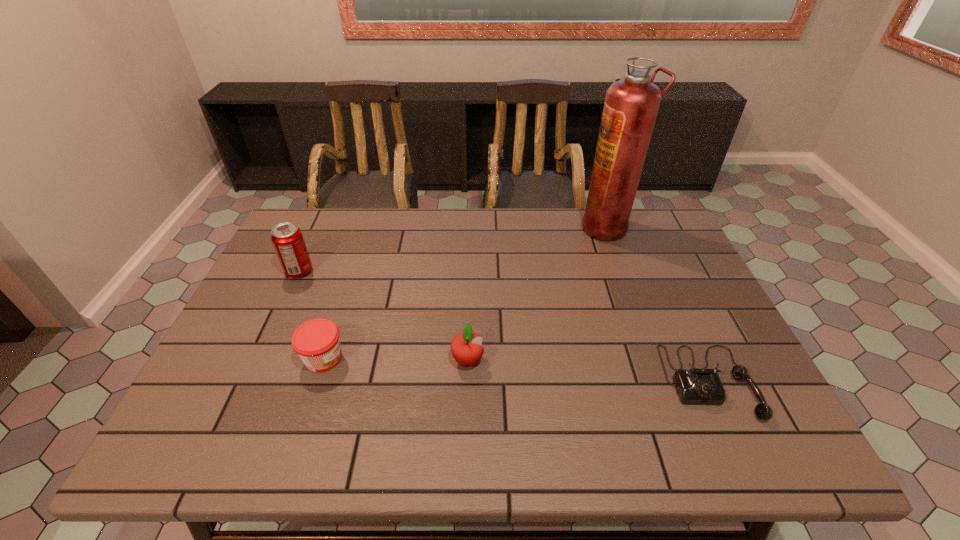
At what (x,y) coordinates should I click in order to perform the action: click on unoccupied area between the fourth object from right to left and the fire extinguisher. Please return your answer as a coordinate pair (x, y). The width and height of the screenshot is (960, 540). Looking at the image, I should click on (465, 293).

Where is `vacant region between the third object from left to right and the second farthest object`? This screenshot has height=540, width=960. vacant region between the third object from left to right and the second farthest object is located at coordinates (383, 316).

You are a GUI agent. You are given a task and a screenshot of the screen. Output one action in this format:
    pyautogui.click(x=<x>, y=<y>)
    Task: Click on the vacant space that's between the second tallest object and the apple
    The width and height of the screenshot is (960, 540).
    Given the screenshot: What is the action you would take?
    pyautogui.click(x=383, y=316)

What are the coordinates of `empty location between the leftmost object and the jam` in the screenshot? It's located at (311, 315).

The width and height of the screenshot is (960, 540). I want to click on empty space between the farthest object and the telephone, so click(x=658, y=305).

What are the coordinates of `vacant area between the fire extinguisher and the telephone` in the screenshot? It's located at (658, 305).

Locate which object ranks fourth in proximity to the fourth object from right to left. Please provide its 2D coordinates. Your answer should be formatted as a tuple, i.e. [(x, y)], where the tuple contains the x and y coordinates of a point satisfying the conditions above.

[(631, 105)]

The height and width of the screenshot is (540, 960). In order to click on object that is the fourth closest to the tallest object in this screenshot , I will do `click(287, 238)`.

At what (x,y) coordinates should I click in order to perform the action: click on vacant space that satisfies the following two spatial constraints: 1. on the back side of the third object from right to left; 2. on the label side of the jam. Please return your answer as a coordinate pair (x, y). This screenshot has height=540, width=960. Looking at the image, I should click on (468, 358).

Find the location of a particular element. vacant space that satisfies the following two spatial constraints: 1. on the label side of the jam; 2. on the right side of the apple is located at coordinates (323, 360).